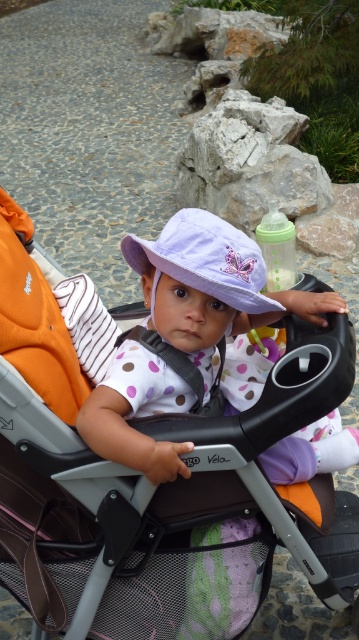
Question: Is orange fabric stroller at center thinner than matte white hat at center?

Choices:
 (A) no
 (B) yes

Answer: (A)

Question: Is orange fabric stroller at center positioned at the back of matte white hat at center?

Choices:
 (A) no
 (B) yes

Answer: (A)

Question: Which object is closer to the camera taking this photo?

Choices:
 (A) orange fabric stroller at center
 (B) lavender fabric hat at center
 (C) matte white hat at center

Answer: (A)

Question: Which point is farther from the camera taking this photo?

Choices:
 (A) (95, 484)
 (B) (226, 300)
 (C) (225, 388)

Answer: (C)

Question: Considering the real-world distances, which object is farthest from the orange fabric stroller at center?

Choices:
 (A) matte white hat at center
 (B) lavender fabric hat at center

Answer: (B)

Question: Does matte white hat at center appear on the right side of lavender fabric hat at center?

Choices:
 (A) yes
 (B) no

Answer: (A)